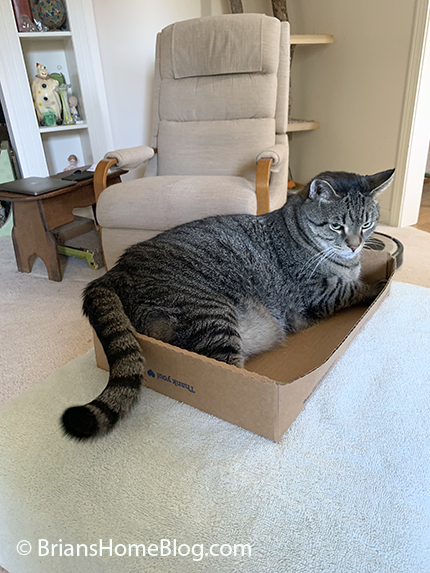
At what (x,y) coordinates should I click in order to perform the action: click on chair. Please return your answer as a coordinate pair (x, y). The height and width of the screenshot is (573, 430). Looking at the image, I should click on (217, 120).